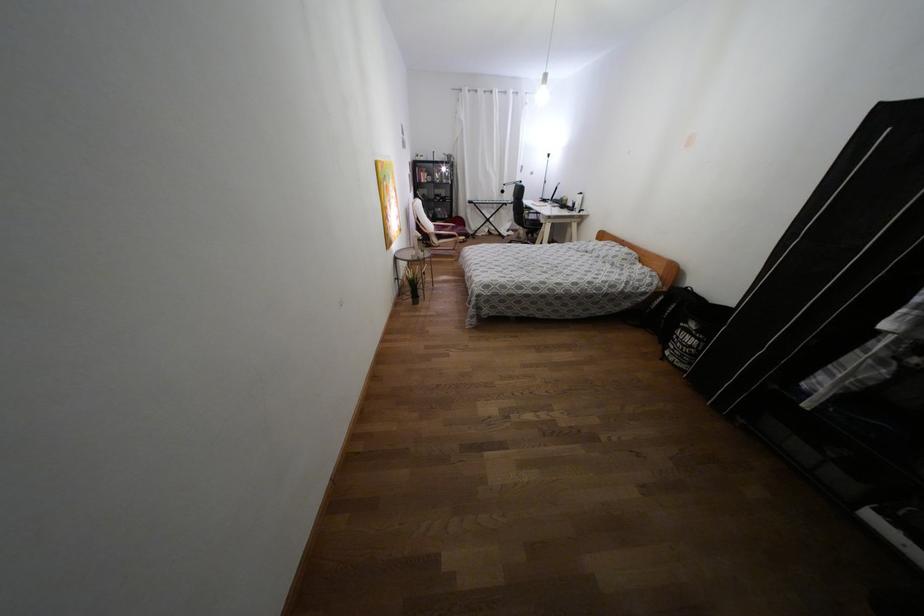
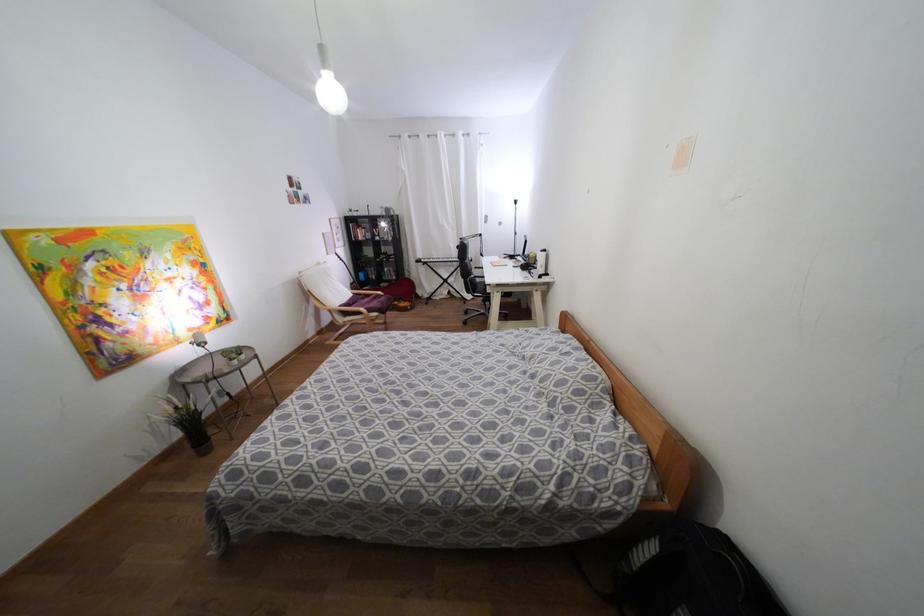
Find the pixel in the second image that matches [457,228] in the first image.

(382, 299)